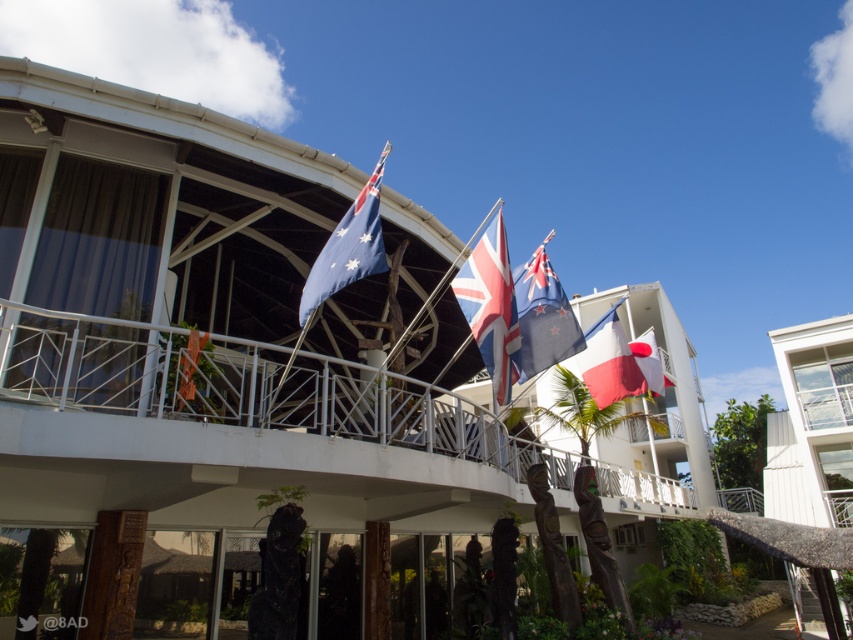
Question: Considering the real-world distances, which object is farthest from the red and white fabric flag at center?

Choices:
 (A) white metal balcony at center
 (B) blue fabric flag at upper center
 (C) white woolen flag at center

Answer: (A)

Question: Which object is closer to the camera taking this photo?

Choices:
 (A) white fabric flag at center
 (B) white metal balcony at center
 (C) red and white fabric flag at center

Answer: (B)

Question: Which point appears closest to the camera in this image?

Choices:
 (A) (370, 225)
 (B) (656, 380)

Answer: (A)

Question: From the image, what is the correct spatial relationship of white glass building at right in relation to white woolen flag at center?

Choices:
 (A) above
 (B) below

Answer: (B)

Question: Is white woolen flag at center above white fabric flag at center?

Choices:
 (A) yes
 (B) no

Answer: (A)

Question: Is white glass building at right smaller than matte white flag at center?

Choices:
 (A) no
 (B) yes

Answer: (A)